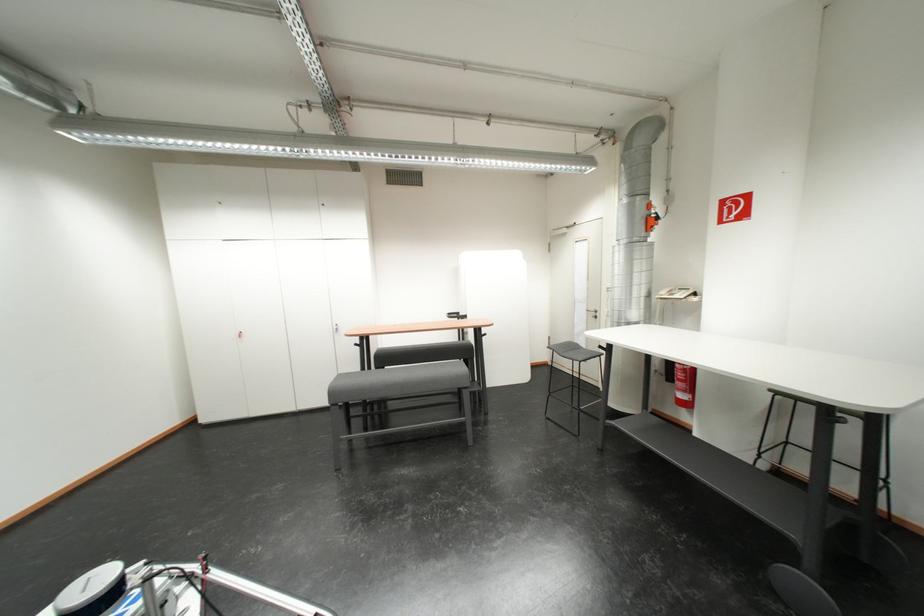
What do you see at coordinates (591, 313) in the screenshot? I see `the silver door handle` at bounding box center [591, 313].